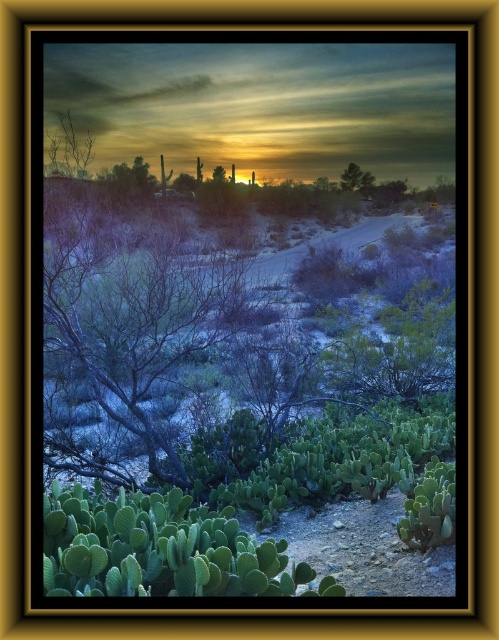
You are an astronomer observing the desert sky. You notice a star at point [69,150]. Based on the scene description, where exactly in the image is this star located?

The star at point [69,150] is located on the bare branches at upper left.

You are standing in the desert and see two points marked on the horizon. The first point is at coordinates point (66, 152) and the second is at point (359, 179). Which point is closer to you?

Point (66, 152) is in front of point (359, 179), so it is closer to you.